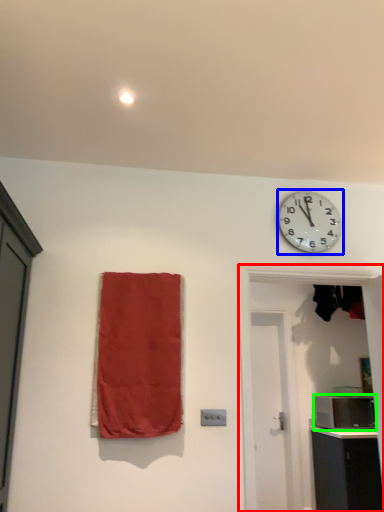
Question: Based on their relative distances, which object is farther from door (highlighted by a red box)? Choose from wall clock (highlighted by a blue box) and appliance (highlighted by a green box).

Choices:
 (A) wall clock
 (B) appliance

Answer: (B)